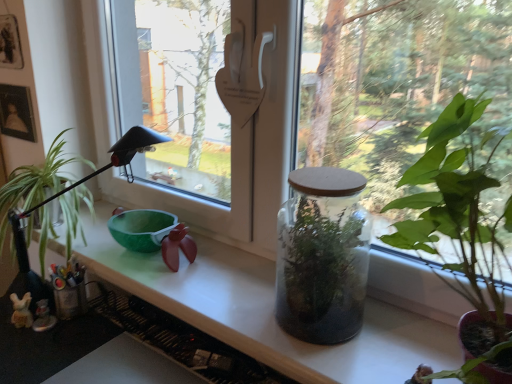
Question: Considering the relative positions of transparent glass jar at center and translucent glass jar at center in the image provided, is transparent glass jar at center to the right of translucent glass jar at center from the viewer's perspective?

Choices:
 (A) yes
 (B) no

Answer: (A)

Question: Is transparent glass jar at center not near translucent glass jar at center?

Choices:
 (A) yes
 (B) no

Answer: (B)

Question: Is transparent glass jar at center touching translucent glass jar at center?

Choices:
 (A) yes
 (B) no

Answer: (B)

Question: Considering the relative sizes of transparent glass jar at center and translucent glass jar at center in the image provided, is transparent glass jar at center smaller than translucent glass jar at center?

Choices:
 (A) no
 (B) yes

Answer: (B)

Question: Is translucent glass jar at center surrounded by transparent glass jar at center?

Choices:
 (A) yes
 (B) no

Answer: (B)

Question: Is green glossy houseplant at left, placed as the first houseplant when sorted from left to right, taller or shorter than translucent glass jar at center?

Choices:
 (A) short
 (B) tall

Answer: (B)

Question: Relative to translucent glass jar at center, is green glossy houseplant at left, placed as the first houseplant when sorted from left to right, in front or behind?

Choices:
 (A) behind
 (B) front

Answer: (A)

Question: From a real-world perspective, is green glossy houseplant at left, marked as the second houseplant in a right-to-left arrangement, positioned above or below translucent glass jar at center?

Choices:
 (A) above
 (B) below

Answer: (A)

Question: Is green glossy houseplant at left, which is the second houseplant in front-to-back order, inside or outside of translucent glass jar at center?

Choices:
 (A) outside
 (B) inside

Answer: (A)

Question: Visually, is translucent glass jar at center positioned to the left or to the right of translucent glass terrarium at center, which appears as the 2th houseplant when viewed from the back?

Choices:
 (A) right
 (B) left

Answer: (B)

Question: From a real-world perspective, is translucent glass jar at center above or below translucent glass terrarium at center, arranged as the 1th houseplant when viewed from the front?

Choices:
 (A) above
 (B) below

Answer: (B)

Question: Is translucent glass jar at center inside or outside of translucent glass terrarium at center, marked as the first houseplant in a right-to-left arrangement?

Choices:
 (A) outside
 (B) inside

Answer: (A)

Question: Is point (189, 283) closer or farther from the camera than point (483, 306)?

Choices:
 (A) closer
 (B) farther

Answer: (B)

Question: In terms of width, does translucent glass terrarium at center, marked as the first houseplant in a right-to-left arrangement, look wider or thinner when compared to transparent glass jar at center?

Choices:
 (A) thin
 (B) wide

Answer: (B)

Question: Is translucent glass terrarium at center, the 2th houseplant from the left, inside or outside of transparent glass jar at center?

Choices:
 (A) inside
 (B) outside

Answer: (B)